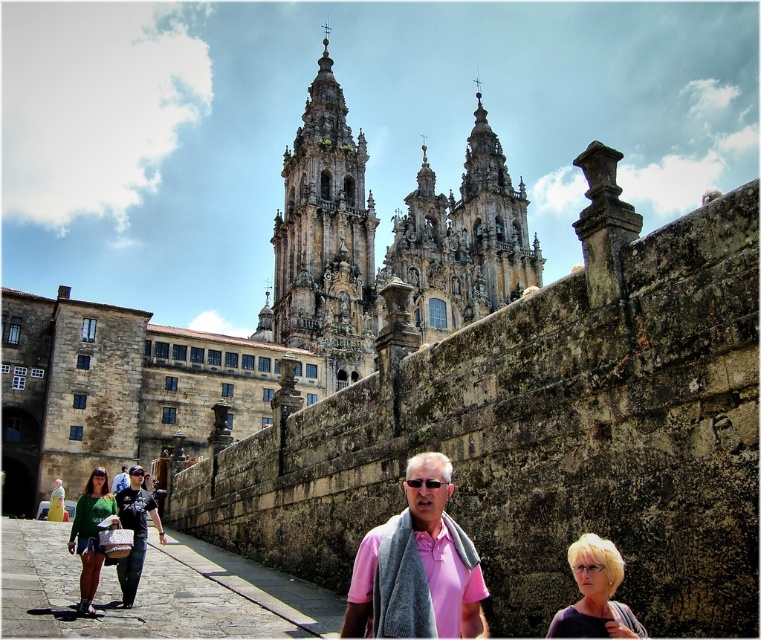
Question: In this image, where is stone-carved tower at center located relative to pink fabric at center?

Choices:
 (A) below
 (B) above

Answer: (B)

Question: Which point appears closest to the camera in this image?

Choices:
 (A) (88, 596)
 (B) (123, 465)
 (C) (121, 588)

Answer: (A)

Question: Which object is farther from the camera taking this photo?

Choices:
 (A) black t-shirt at lower left
 (B) blonde hair at lower right
 (C) matte green shirt at lower left

Answer: (A)

Question: Does stone-carved tower at center appear under pink fabric at center?

Choices:
 (A) yes
 (B) no

Answer: (B)

Question: Which point is closer to the camera taking this photo?

Choices:
 (A) (94, 573)
 (B) (314, 156)
 (C) (562, 616)

Answer: (C)

Question: In this image, where is blonde hair at lower right located relative to matte green shirt at lower left?

Choices:
 (A) right
 (B) left

Answer: (A)